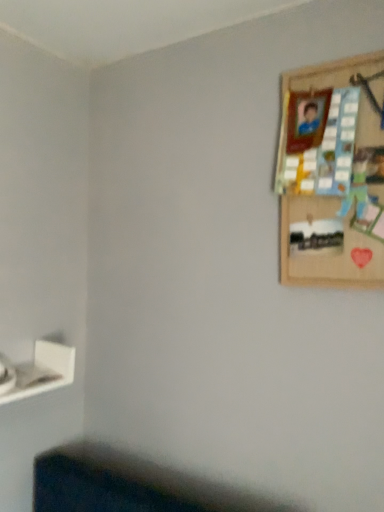
Question: In terms of width, does wooden picture frame at upper right look wider or thinner when compared to white matte shelf at lower left?

Choices:
 (A) wide
 (B) thin

Answer: (B)

Question: Does point (311, 267) appear closer or farther from the camera than point (46, 361)?

Choices:
 (A) closer
 (B) farther

Answer: (A)

Question: From a real-world perspective, is wooden picture frame at upper right physically located above or below white matte shelf at lower left?

Choices:
 (A) above
 (B) below

Answer: (A)

Question: From a real-world perspective, is white matte shelf at lower left above or below wooden picture frame at upper right?

Choices:
 (A) below
 (B) above

Answer: (A)

Question: Considering the positions of white matte shelf at lower left and wooden picture frame at upper right in the image, is white matte shelf at lower left taller or shorter than wooden picture frame at upper right?

Choices:
 (A) tall
 (B) short

Answer: (B)

Question: Is white matte shelf at lower left bigger or smaller than wooden picture frame at upper right?

Choices:
 (A) small
 (B) big

Answer: (A)

Question: From the image's perspective, is white matte shelf at lower left positioned above or below wooden picture frame at upper right?

Choices:
 (A) above
 (B) below

Answer: (B)